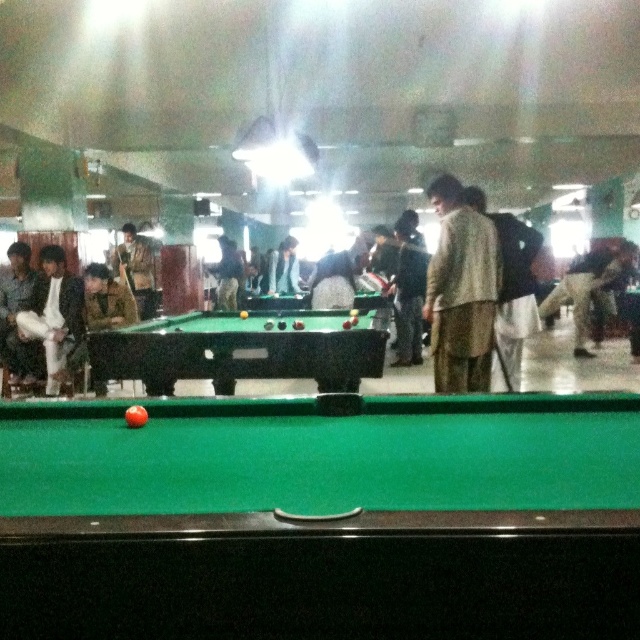
Question: Observing the image, what is the correct spatial positioning of light beige fabric jacket at center in reference to camouflage jacket at center?

Choices:
 (A) left
 (B) right

Answer: (B)

Question: Can you confirm if green felt pool table at center is smaller than light beige fabric jacket at center?

Choices:
 (A) yes
 (B) no

Answer: (B)

Question: Considering the real-world distances, which object is farthest from the green felt billiard table at center?

Choices:
 (A) light beige fabric jacket at center
 (B) matte black cue at center
 (C) camouflage jacket at center
 (D) white cotton pants at left

Answer: (C)

Question: Estimate the real-world distances between objects in this image. Which object is closer to the green felt pool table at center?

Choices:
 (A) matte black cue at center
 (B) light beige fabric jacket at center
 (C) green felt billiard table at center
 (D) camouflage jacket at center

Answer: (B)

Question: Which point is closer to the camera taking this photo?

Choices:
 (A) (298, 291)
 (B) (372, 456)
 (C) (323, 364)
 (D) (444, 381)

Answer: (B)

Question: In this image, where is green felt billiard table at center located relative to camouflage jacket at center?

Choices:
 (A) above
 (B) below

Answer: (B)